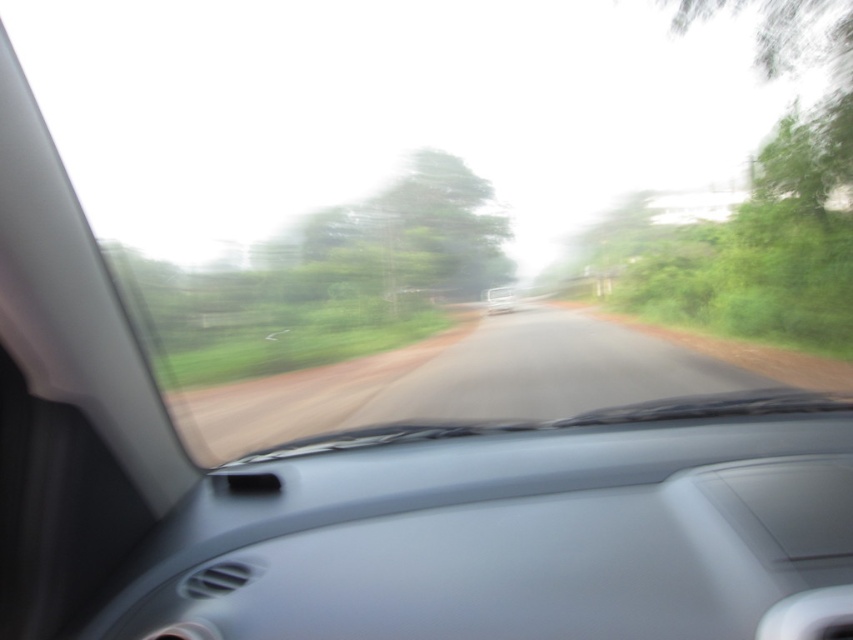
You are sitting in the driver seat of the car and looking through the windshield. There are two points marked on the road ahead. The first point is at coordinates point (190, 289) and the second point is at point (514, 289). Which point is closer to you?

Point (190, 289) is closer to the viewer than point (514, 289).

You are driving a car and want to know if the green leafy tree at center is taller than the white glossy car at center. Can you determine this based on the scene?

The green leafy tree at center has a greater height compared to the white glossy car at center, so yes, the green leafy tree at center is taller than the white glossy car at center.

You are driving a car and want to know if the green leafy tree at center is wider than the white glossy car at center. Can you confirm this based on the scene?

The green leafy tree at center is wider than the white glossy car at center according to the description.